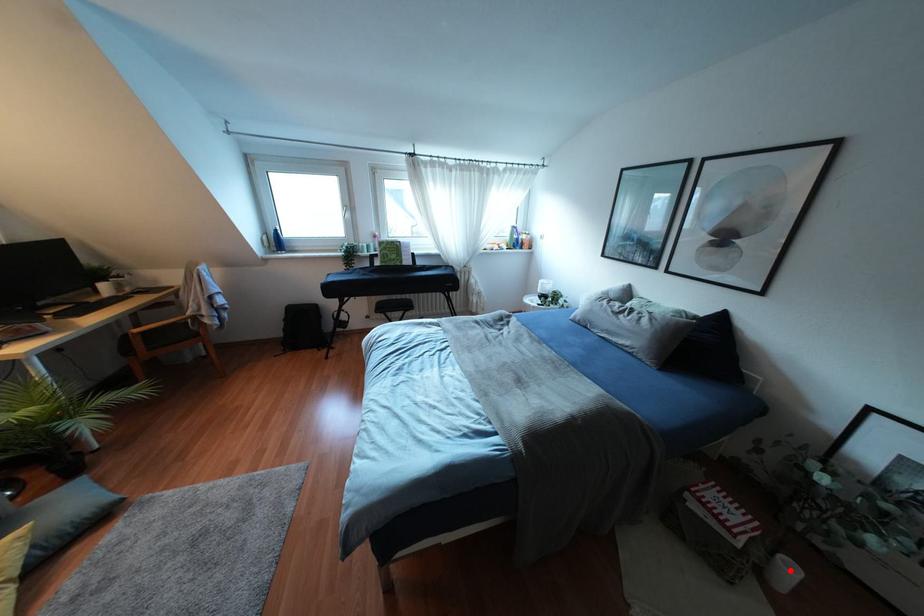
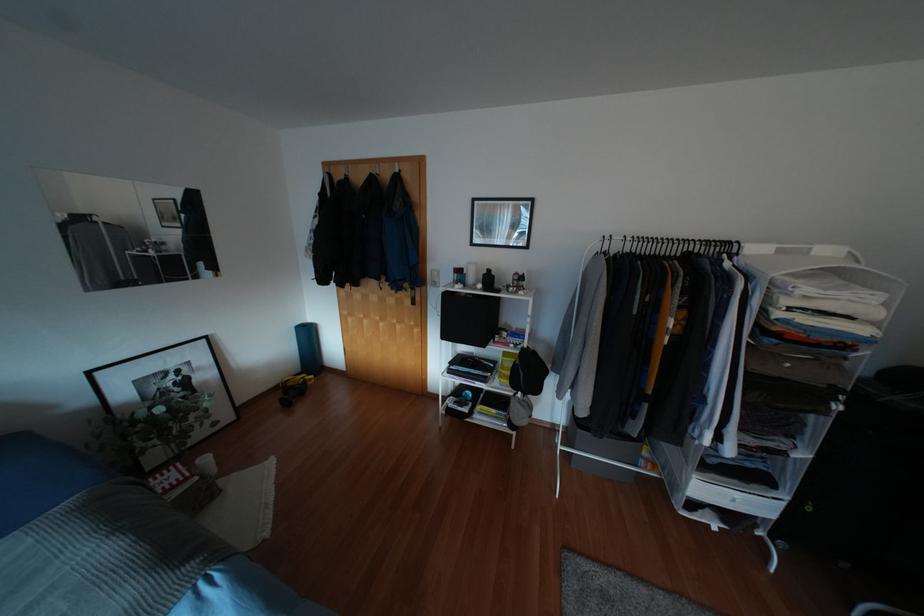
Locate, in the second image, the point that corresponds to the highlighted location in the first image.

(205, 459)